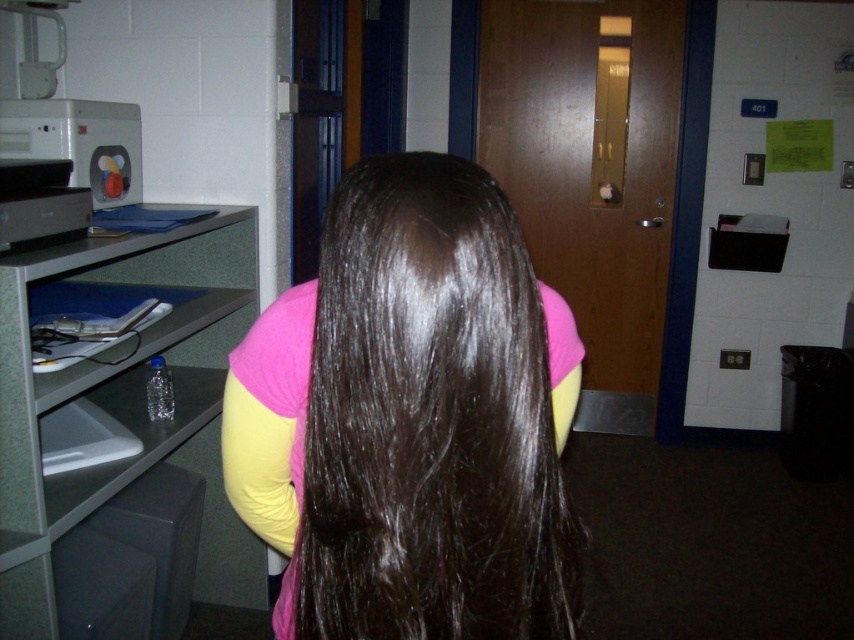
You are a photographer trying to capture a portrait of the person with shiny brown hair at center. You have a camera that requires a minimum distance of 18 inches to focus properly. Can you take the photo from your current position?

The shiny brown hair at center and camera are 21.07 inches apart from each other, which is more than the required 18 inches. Therefore, you can take the photo from your current position.

What is the exact coordinate of the shiny brown hair at center?

The shiny brown hair at center is located at point [411,419].

You are an office worker who needs to reach the gray plastic file cabinet at left while standing behind the shiny brown hair at center. Can you walk directly to the file cabinet without moving around?

The shiny brown hair at center is in front of the gray plastic file cabinet at left, so you cannot walk directly to the gray plastic file cabinet at left without moving around since the shiny brown hair at center is blocking the path.